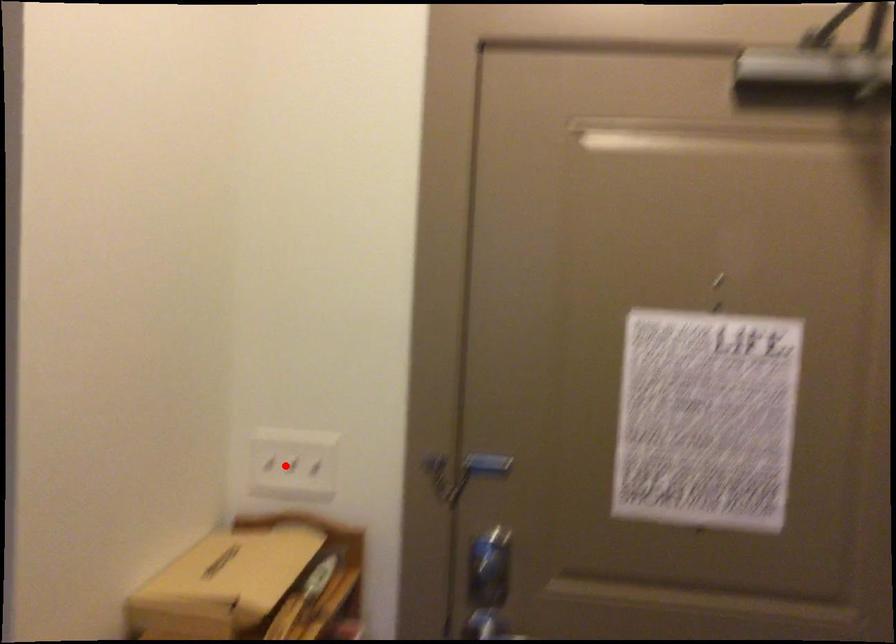
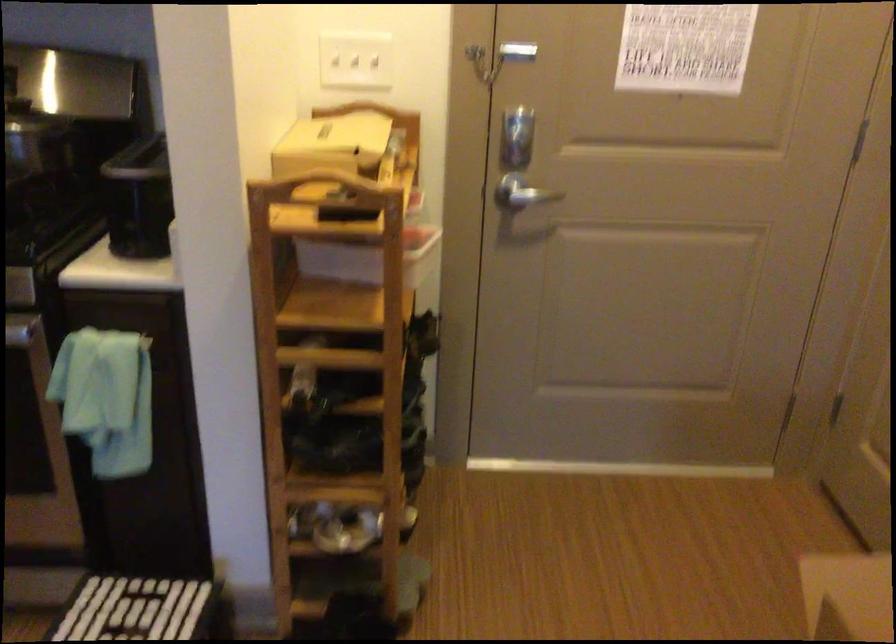
The point at the highlighted location is marked in the first image. Where is the corresponding point in the second image?

(356, 61)